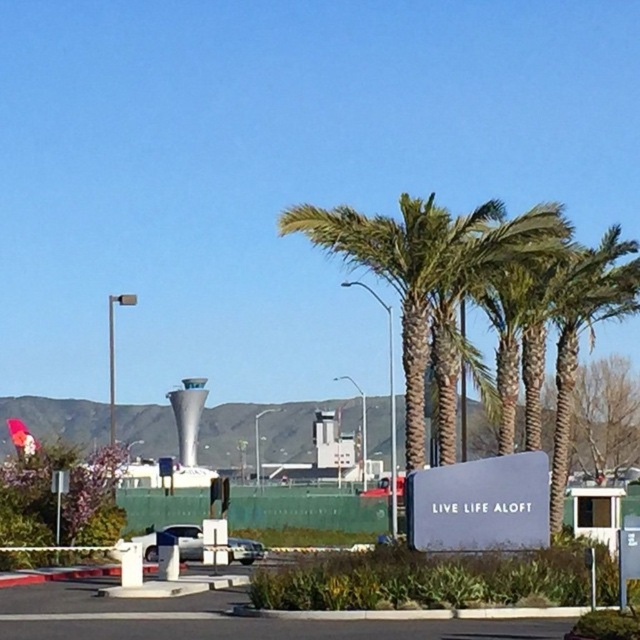
Question: Is metallic silver car at center bigger than metallic silver sedan at center?

Choices:
 (A) no
 (B) yes

Answer: (B)

Question: Does white smooth control tower at center have a greater width compared to metallic silver sedan at center?

Choices:
 (A) yes
 (B) no

Answer: (A)

Question: Is white smooth control tower at center smaller than metallic silver car at center?

Choices:
 (A) no
 (B) yes

Answer: (A)

Question: Which point is farther to the camera?

Choices:
 (A) (147, 560)
 (B) (250, 541)

Answer: (B)

Question: Which object is closer to the camera taking this photo?

Choices:
 (A) white smooth control tower at center
 (B) metallic silver sedan at center

Answer: (B)

Question: Which point is farther to the camera?

Choices:
 (A) metallic silver car at center
 (B) metallic silver sedan at center

Answer: (B)